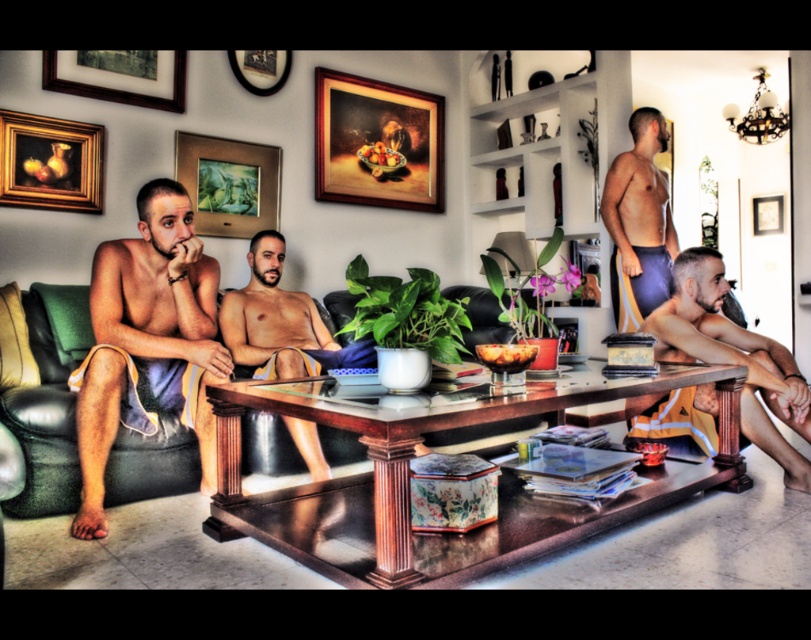
Is matte purple shorts at right below matte white picture frame at upper right?

Yes.

Does matte purple shorts at right appear on the left side of matte white picture frame at upper right?

Correct, you'll find matte purple shorts at right to the left of matte white picture frame at upper right.

In order to click on matte purple shorts at right in this screenshot , I will do `click(638, 221)`.

Identify the location of matte purple shorts at right. (638, 221).

Between point (162, 468) and point (756, 208), which one is positioned in front?

Point (162, 468) is in front.

Does leather couch at center appear over matte white picture frame at upper right?

Actually, leather couch at center is below matte white picture frame at upper right.

Identify the location of leather couch at center. The width and height of the screenshot is (811, 640). (43, 426).

Which is below, leather couch at center or wooden picture frame at upper left?

Positioned lower is leather couch at center.

Measure the distance between leather couch at center and wooden picture frame at upper left.

The distance of leather couch at center from wooden picture frame at upper left is 4.35 feet.

The width and height of the screenshot is (811, 640). Describe the element at coordinates (43, 426) in the screenshot. I see `leather couch at center` at that location.

This screenshot has width=811, height=640. Identify the location of leather couch at center. (43, 426).